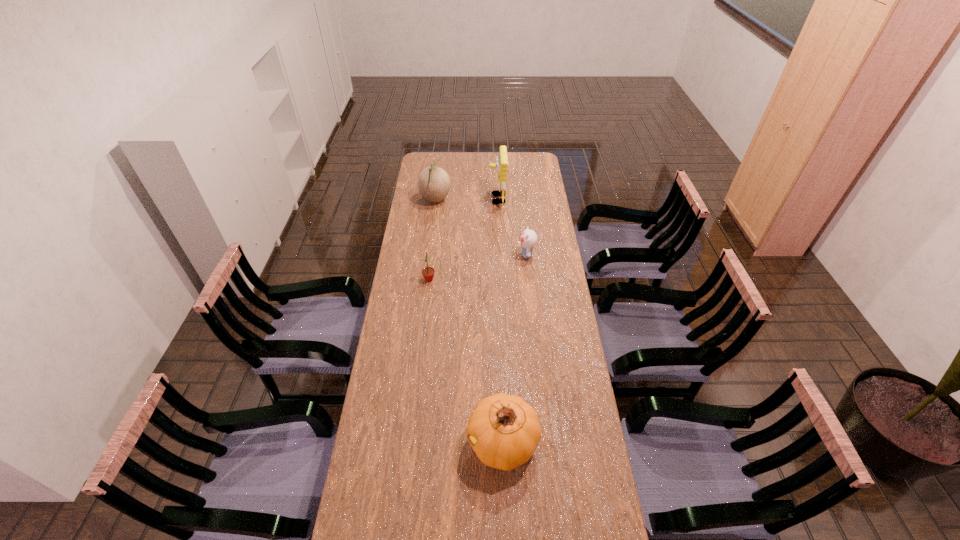
Locate an element on the screen. This screenshot has width=960, height=540. object present at the right edge is located at coordinates pyautogui.click(x=528, y=238).

Where is `vacant space at the far edge of the desktop`? The image size is (960, 540). vacant space at the far edge of the desktop is located at coordinates (462, 158).

This screenshot has width=960, height=540. I want to click on vacant area at the left edge of the desktop, so click(x=395, y=467).

I want to click on vacant space at the right edge, so click(562, 312).

Where is `free space at the far left corner of the desktop`? The height and width of the screenshot is (540, 960). free space at the far left corner of the desktop is located at coordinates (434, 161).

Locate an element on the screen. This screenshot has width=960, height=540. free space between the nearest object and the kitten is located at coordinates (515, 348).

Identify the location of vacant area that lies between the fourth tallest object and the cantaloup. The height and width of the screenshot is (540, 960). (432, 240).

Find the location of a particular element. The height and width of the screenshot is (540, 960). free space between the sponge and the nearest object is located at coordinates (500, 321).

Identify the location of unoccupied area between the kitten and the sponge. (512, 227).

In order to click on free space between the third nearest object and the fourth farthest object in this screenshot , I will do `click(478, 267)`.